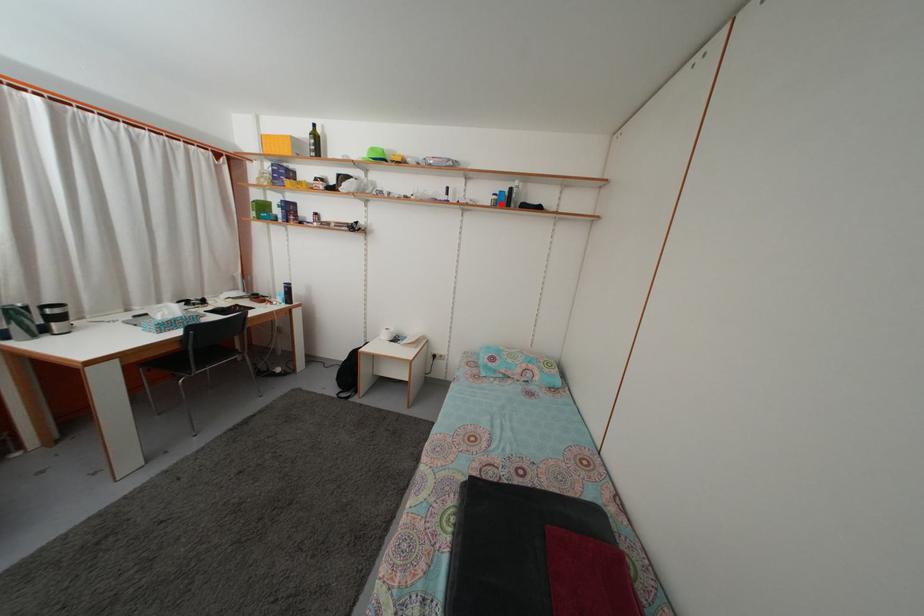
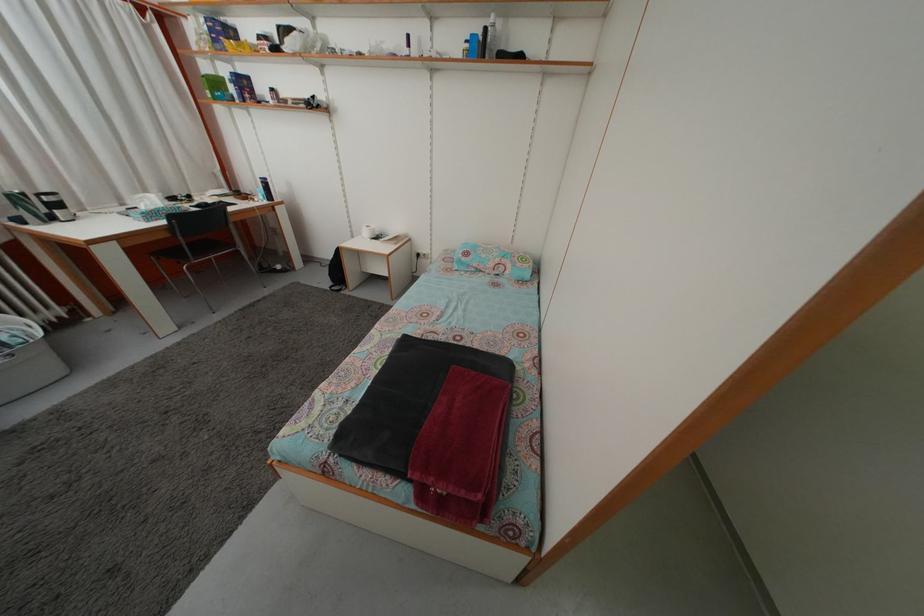
Find the pixel in the second image that matches the highlighted location in the first image.

(473, 53)